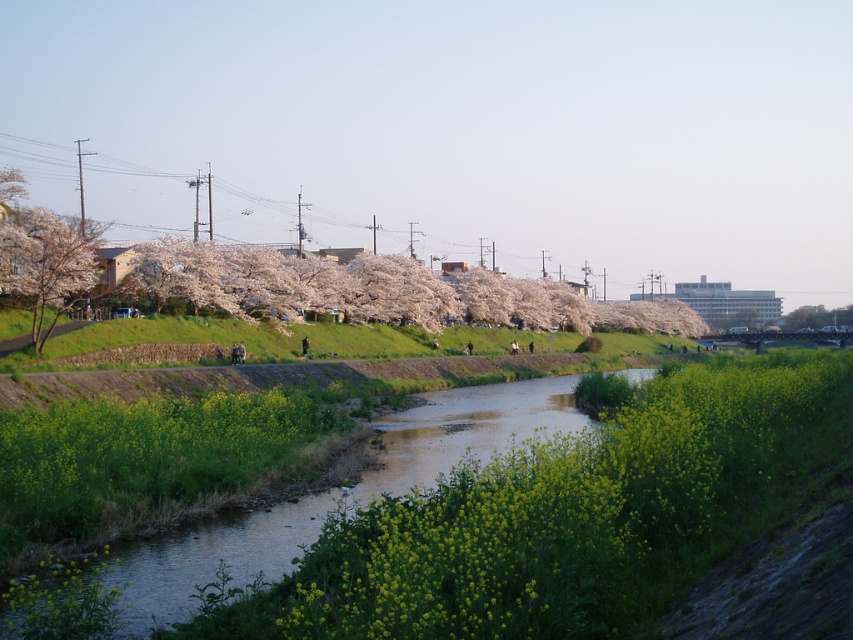
Question: Is green leafy plant at center smaller than metallic wires at upper center?

Choices:
 (A) no
 (B) yes

Answer: (B)

Question: Estimate the real-world distances between objects in this image. Which object is farther from the green grassy water at center?

Choices:
 (A) metallic wires at upper center
 (B) green leafy plant at center

Answer: (A)

Question: Estimate the real-world distances between objects in this image. Which object is farther from the cherry blossom tree at left?

Choices:
 (A) green leafy plant at center
 (B) green grassy water at center

Answer: (A)

Question: Can you confirm if green leafy plant at center is positioned to the right of metallic wires at upper center?

Choices:
 (A) yes
 (B) no

Answer: (A)

Question: Can you confirm if metallic wires at upper center is wider than cherry blossom tree at left?

Choices:
 (A) no
 (B) yes

Answer: (B)

Question: Which of the following is the farthest from the observer?

Choices:
 (A) cherry blossom tree at left
 (B) green leafy plant at center

Answer: (A)